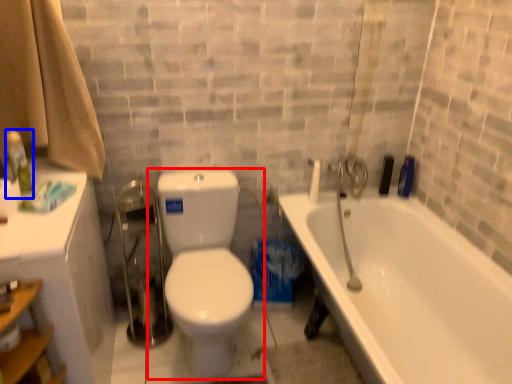
Question: Which object appears farthest to the camera in this image, toilet (highlighted by a red box) or toiletry (highlighted by a blue box)?

Choices:
 (A) toilet
 (B) toiletry

Answer: (B)